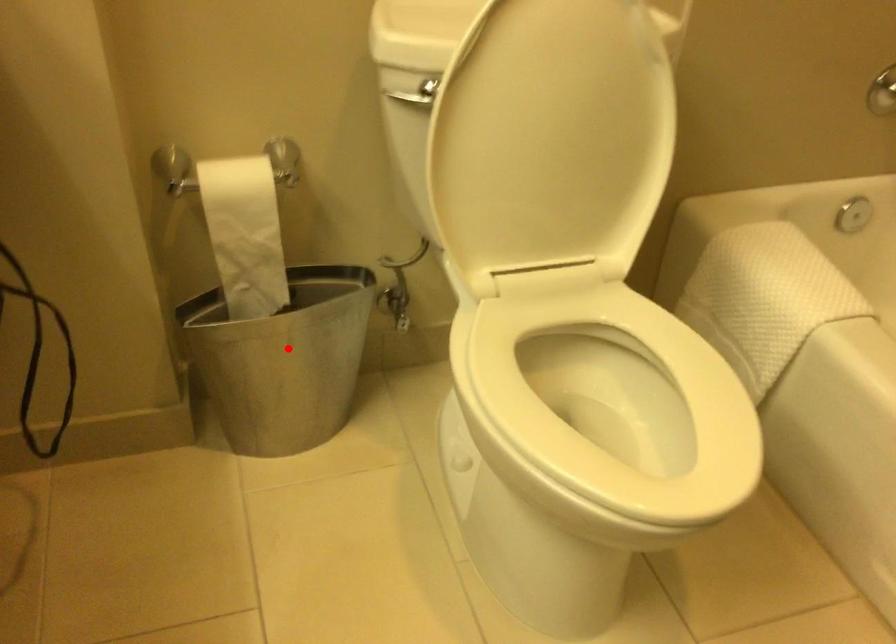
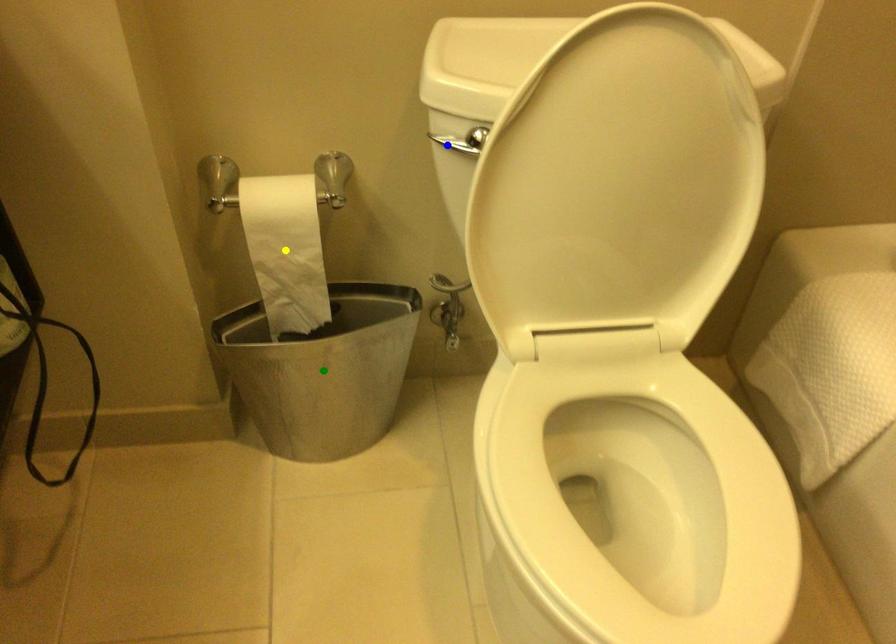
Question: I am providing you with two images of the same scene from different viewpoints. A red point is marked on the first image. You are given multiple points on the second image. Can you choose the point in image 2 that corresponds to the point in image 1?

Choices:
 (A) green point
 (B) blue point
 (C) yellow point

Answer: (A)